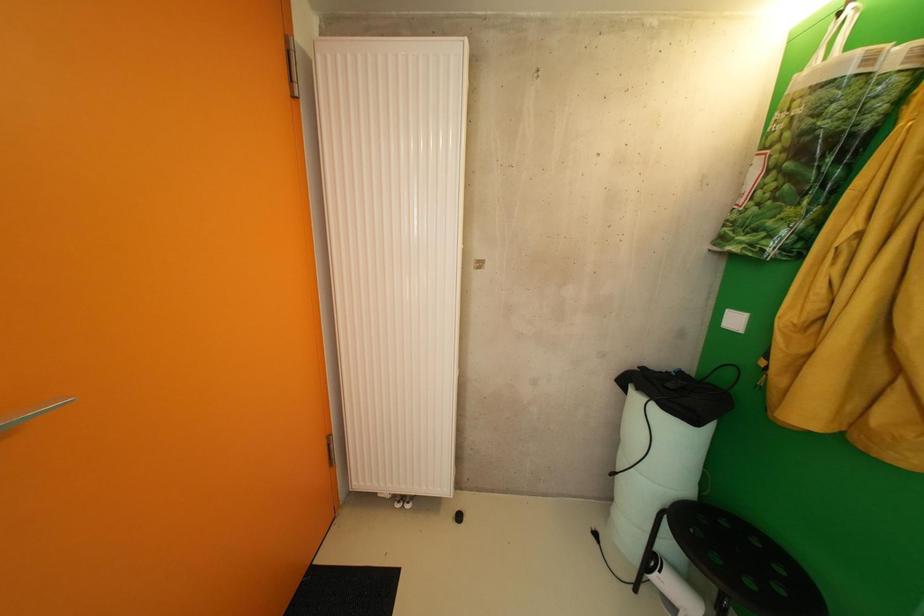
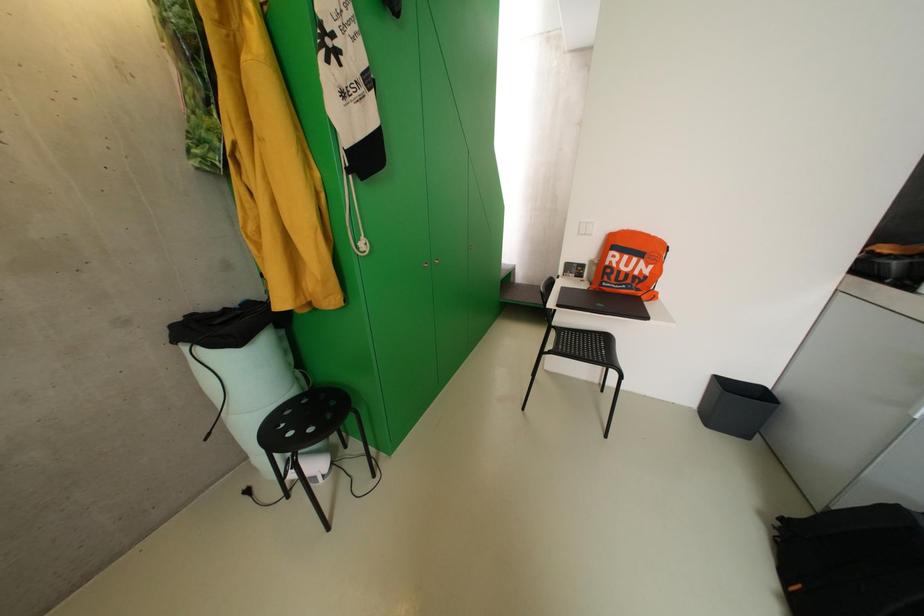
From the picture: The images are taken continuously from a first-person perspective. In which direction is your viewpoint rotating?

The rotation direction of the camera is right-down.